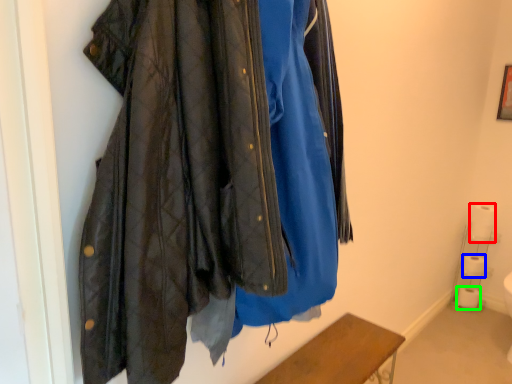
Question: Which object is the closest to the toilet paper (highlighted by a red box)? Choose among these: toilet paper (highlighted by a blue box) or toilet paper (highlighted by a green box).

Choices:
 (A) toilet paper
 (B) toilet paper

Answer: (A)